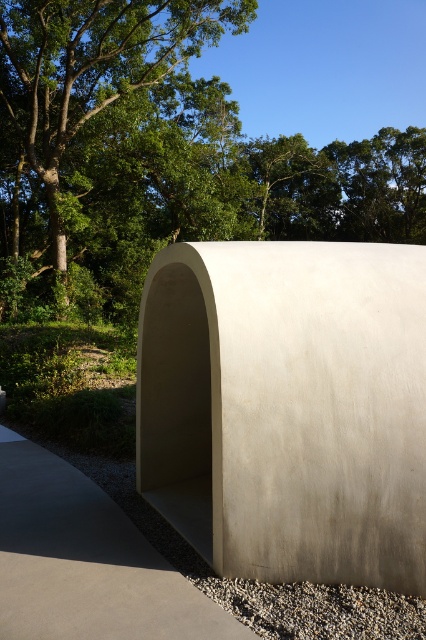
Is green leafy tree at upper left in front of gray gravel at lower center?

No, green leafy tree at upper left is further to the viewer.

Measure the distance between point [218,148] and camera.

Point [218,148] and camera are 83.25 feet apart from each other.

Identify the location of green leafy tree at upper left. (108, 145).

Between point (54, 156) and point (88, 508), which one is positioned in front?

Point (88, 508) is more forward.

Which of these two, green leafy tree at upper left or smooth concrete bench at center, stands shorter?

smooth concrete bench at center is shorter.

Is point (89, 20) positioned in front of point (81, 502)?

No, (89, 20) is further to viewer.

The height and width of the screenshot is (640, 426). In order to click on green leafy tree at upper left in this screenshot , I will do `click(108, 145)`.

Does white concrete shelter at center appear over gray gravel at lower center?

Correct, white concrete shelter at center is located above gray gravel at lower center.

Between point (215, 390) and point (420, 602), which one is positioned behind?

The point (215, 390) is behind.

The width and height of the screenshot is (426, 640). What are the coordinates of `white concrete shelter at center` in the screenshot? It's located at (287, 406).

Find the location of a particular element. white concrete shelter at center is located at coordinates (287, 406).